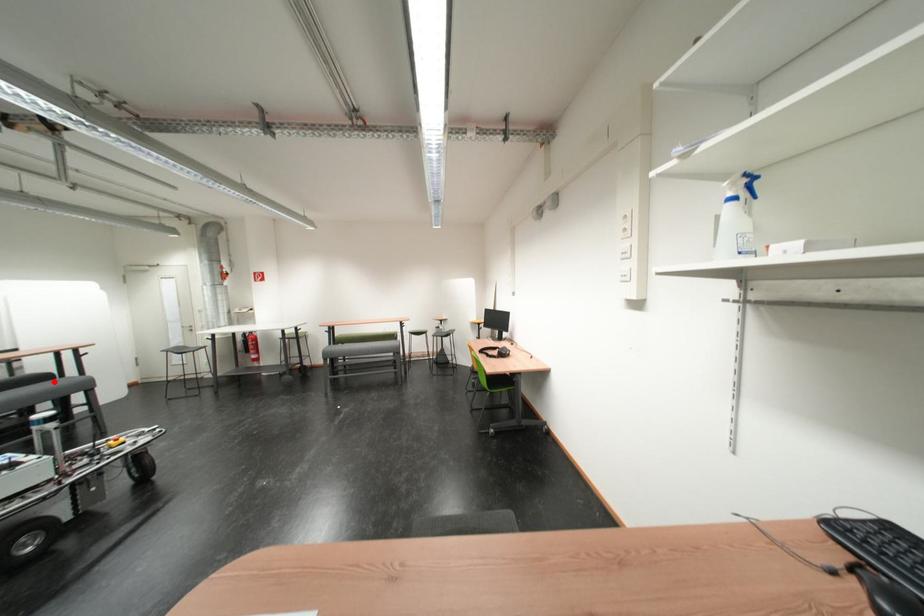
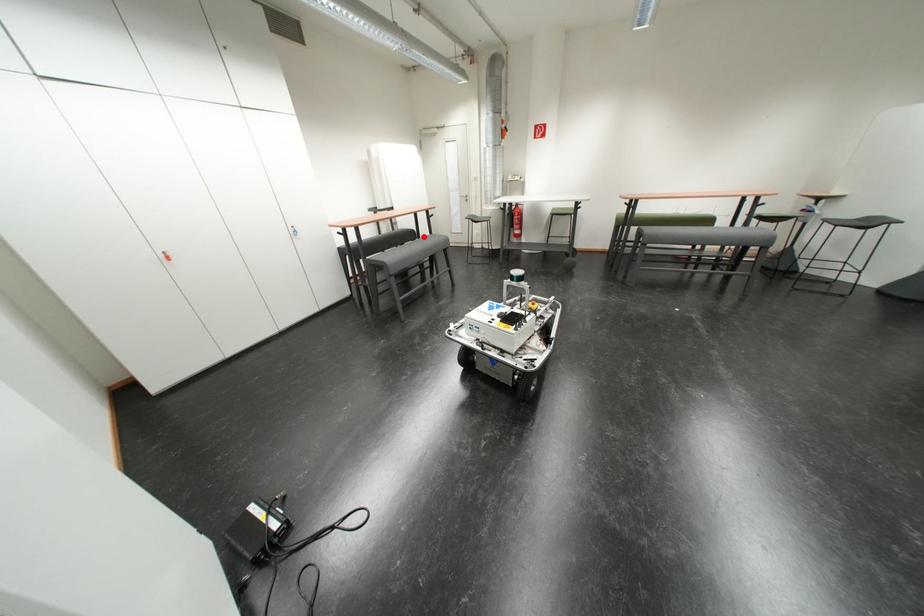
I am providing you with two images of the same scene from different viewpoints. A red point is marked on the first image and another point is marked on the second image. Are the points marked in image1 and image2 representing the same 3D position?

Yes